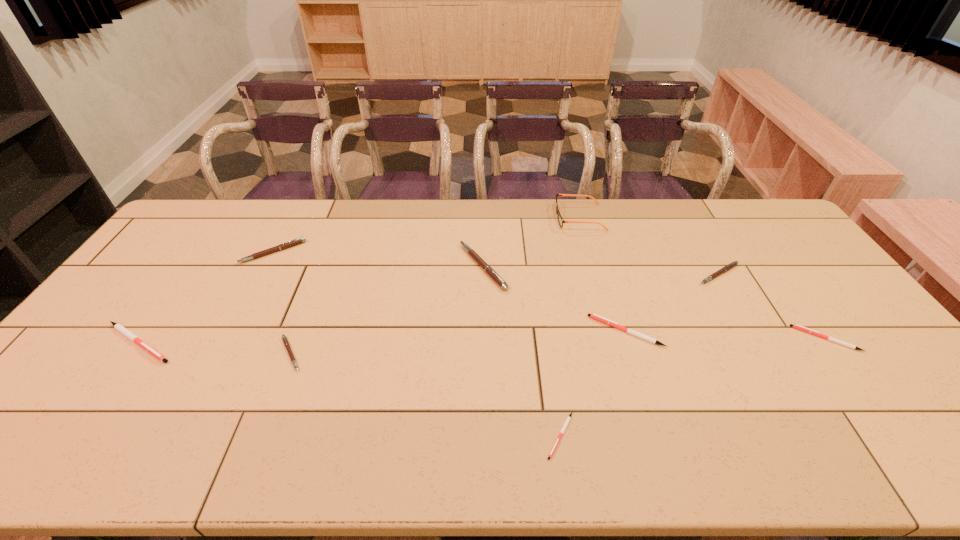
You are a GUI agent. You are given a task and a screenshot of the screen. Output one action in this format:
    pyautogui.click(x=<x>, y=<y>)
    Task: Click on the vacant region located 0.050m at the nib of the smallest pink pen
    This screenshot has height=540, width=960.
    Given the screenshot: What is the action you would take?
    pyautogui.click(x=324, y=354)

Identify the location of vacant space located on the clicker of the third biggest white pen. The height and width of the screenshot is (540, 960). (665, 339).

You are a GUI agent. You are given a task and a screenshot of the screen. Output one action in this format:
    pyautogui.click(x=<x>, y=<y>)
    Task: Click on the vacant space positioned on the clicker of the third biggest white pen
    
    Given the screenshot: What is the action you would take?
    pyautogui.click(x=764, y=339)

You are a GUI agent. You are given a task and a screenshot of the screen. Output one action in this format:
    pyautogui.click(x=<x>, y=<y>)
    Task: Click on the free space located on the clicker of the third biggest white pen
    The width and height of the screenshot is (960, 540).
    Given the screenshot: What is the action you would take?
    pyautogui.click(x=742, y=339)

You are a GUI agent. You are given a task and a screenshot of the screen. Output one action in this format:
    pyautogui.click(x=<x>, y=<y>)
    Task: Click on the object situated at the far edge
    
    Given the screenshot: What is the action you would take?
    pyautogui.click(x=560, y=220)

Image resolution: width=960 pixels, height=540 pixels. What are the coordinates of `object at the near edge` in the screenshot? It's located at (569, 417).

Where is `object located in the left edge section of the desktop`? The width and height of the screenshot is (960, 540). object located in the left edge section of the desktop is located at coordinates (120, 328).

Where is `object present at the right edge`? The height and width of the screenshot is (540, 960). object present at the right edge is located at coordinates (796, 326).

I want to click on free region at the far edge of the desktop, so click(671, 223).

Where is `free space at the near edge of the desktop`? free space at the near edge of the desktop is located at coordinates (141, 433).